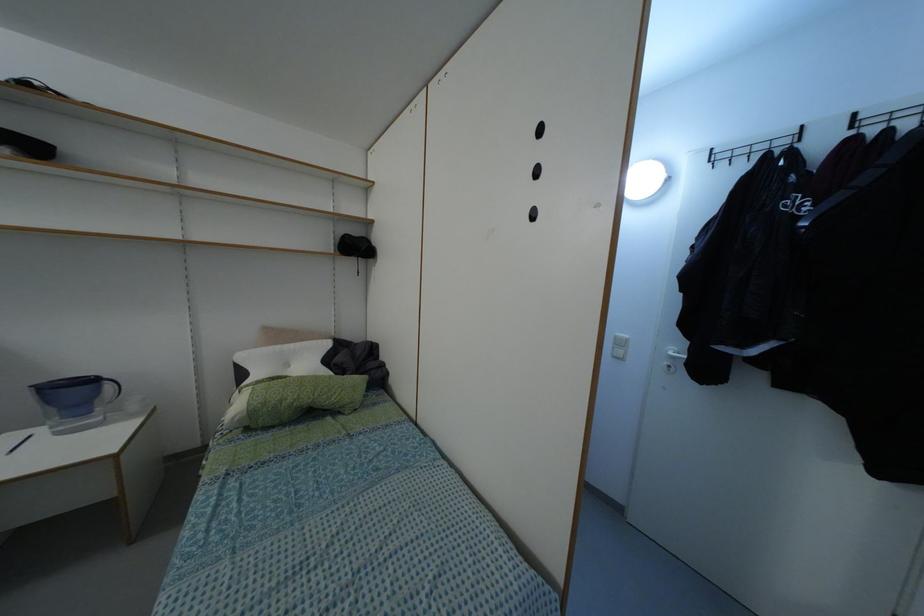
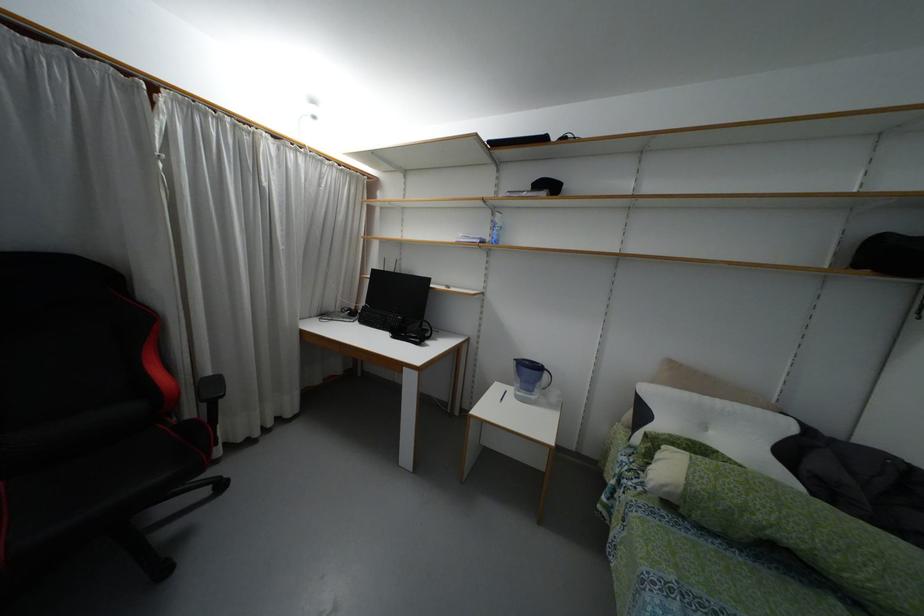
Locate, in the second image, the point that corresponds to (107,386) in the first image.

(544, 375)